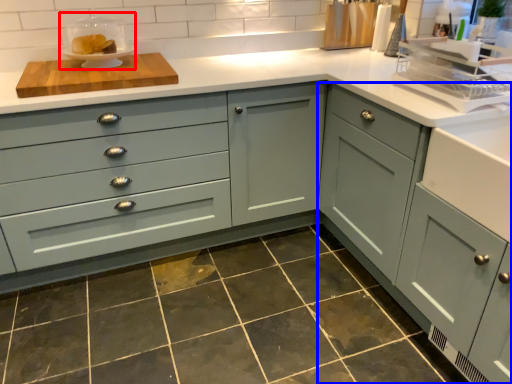
Question: Which object is closer to the camera taking this photo, appliance (highlighted by a red box) or cabinetry (highlighted by a blue box)?

Choices:
 (A) appliance
 (B) cabinetry

Answer: (B)